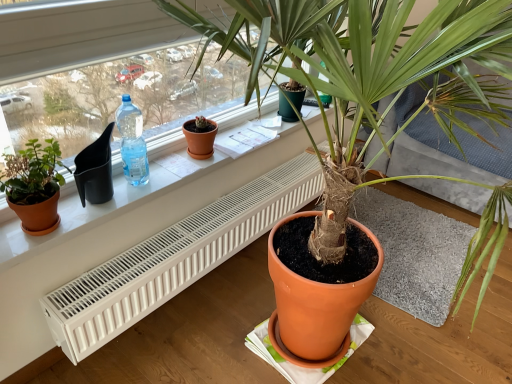
The width and height of the screenshot is (512, 384). What do you see at coordinates (132, 142) in the screenshot? I see `translucent plastic bottle at window left` at bounding box center [132, 142].

At what (x,y) coordinates should I click in order to perform the action: click on matte black pot at upper left. Please return your answer as a coordinate pair (x, y). The image size is (512, 384). Looking at the image, I should click on (120, 96).

This screenshot has height=384, width=512. What do you see at coordinates (174, 259) in the screenshot?
I see `white plastic radiator at lower center` at bounding box center [174, 259].

From the picture: What is the approximate height of matte white radiator at lower center?

It is 3.51 centimeters.

Measure the distance between matte terracotta pot at left, which is the 2th houseplant in right-to-left order, and camera.

A distance of 4.07 feet exists between matte terracotta pot at left, which is the 2th houseplant in right-to-left order, and camera.

The height and width of the screenshot is (384, 512). Describe the element at coordinates (344, 125) in the screenshot. I see `matte orange pot at center, which is the first houseplant in right-to-left order` at that location.

What are the coordinates of `translucent plastic bottle at window left` in the screenshot? It's located at (132, 142).

I want to click on the 1st houseplant positioned above the white plastic radiator at lower center (from the image's perspective), so click(x=34, y=185).

Between matte terracotta pot at left, positioned as the 1th houseplant in left-to-right order, and white plastic radiator at lower center, which one has smaller width?

matte terracotta pot at left, positioned as the 1th houseplant in left-to-right order.

Considering the sizes of objects matte terracotta pot at left, which is the 2th houseplant in right-to-left order, and white plastic radiator at lower center in the image provided, who is shorter, matte terracotta pot at left, which is the 2th houseplant in right-to-left order, or white plastic radiator at lower center?

With less height is white plastic radiator at lower center.

Considering the positions of point (150, 132) and point (11, 158), is point (150, 132) closer or farther from the camera than point (11, 158)?

Point (150, 132) appears to be farther away from the viewer than point (11, 158).

Considering the sizes of objects matte black pot at upper left and matte terracotta pot at left, which is the 2th houseplant in right-to-left order, in the image provided, who is bigger, matte black pot at upper left or matte terracotta pot at left, which is the 2th houseplant in right-to-left order,?

matte black pot at upper left.

Which is correct: matte black pot at upper left is inside matte terracotta pot at left, placed as the 2th houseplant when sorted from front to back, or outside of it?

matte black pot at upper left is not enclosed by matte terracotta pot at left, placed as the 2th houseplant when sorted from front to back.

Considering the relative positions of matte black pot at upper left and terracotta clay pot at center in the image provided, is matte black pot at upper left to the left of terracotta clay pot at center from the viewer's perspective?

Indeed, matte black pot at upper left is positioned on the left side of terracotta clay pot at center.

In the scene shown: From a real-world perspective, is matte black pot at upper left beneath terracotta clay pot at center?

No, from a real-world perspective, matte black pot at upper left is not under terracotta clay pot at center.

Is matte black pot at upper left wider than terracotta clay pot at center?

Correct, the width of matte black pot at upper left exceeds that of terracotta clay pot at center.

Can you confirm if white plastic radiator at lower center is shorter than terracotta clay pot at center?

Incorrect, the height of white plastic radiator at lower center does not fall short of that of terracotta clay pot at center.

From the picture: From a real-world perspective, relative to terracotta clay pot at center, is white plastic radiator at lower center vertically above or below?

Clearly, from a real-world perspective, white plastic radiator at lower center is below terracotta clay pot at center.

Does white plastic radiator at lower center appear on the right side of terracotta clay pot at center?

Yes.

Image resolution: width=512 pixels, height=384 pixels. In order to click on air conditioner in front of the terracotta clay pot at center in this screenshot , I will do `click(174, 259)`.

Locate an element on the screen. This screenshot has height=384, width=512. bottle behind the matte black pot at upper left is located at coordinates (132, 142).

From the image's perspective, is matte black pot at upper left located above translucent plastic bottle at window left?

Yes.

Can you confirm if matte black pot at upper left is thinner than translucent plastic bottle at window left?

In fact, matte black pot at upper left might be wider than translucent plastic bottle at window left.

From the picture: Considering the sizes of objects matte terracotta pot at left, the first houseplant in the back-to-front sequence, and terracotta clay pot at center in the image provided, who is wider, matte terracotta pot at left, the first houseplant in the back-to-front sequence, or terracotta clay pot at center?

matte terracotta pot at left, the first houseplant in the back-to-front sequence, is wider.

Is matte terracotta pot at left, positioned as the 1th houseplant in left-to-right order, looking in the opposite direction of terracotta clay pot at center?

matte terracotta pot at left, positioned as the 1th houseplant in left-to-right order, does not have its back to terracotta clay pot at center.

Is matte terracotta pot at left, placed as the 2th houseplant when sorted from front to back, in contact with terracotta clay pot at center?

matte terracotta pot at left, placed as the 2th houseplant when sorted from front to back, and terracotta clay pot at center are clearly separated.

From the image's perspective, which one is positioned lower, matte terracotta pot at left, which is the 2th houseplant in right-to-left order, or terracotta clay pot at center?

matte terracotta pot at left, which is the 2th houseplant in right-to-left order, is shown below in the image.

Which is more to the right, matte orange pot at center, marked as the 2th houseplant in a back-to-front arrangement, or terracotta clay pot at center?

Positioned to the right is matte orange pot at center, marked as the 2th houseplant in a back-to-front arrangement.

From the image's perspective, is matte orange pot at center, the 2th houseplant when ordered from left to right, located above or below terracotta clay pot at center?

matte orange pot at center, the 2th houseplant when ordered from left to right, is below terracotta clay pot at center.

Which is more distant, [332,137] or [215,132]?

The point [332,137] is farther from the camera.

Is matte orange pot at center, which is the first houseplant in right-to-left order, positioned far away from terracotta clay pot at center?

matte orange pot at center, which is the first houseplant in right-to-left order, is near terracotta clay pot at center, not far away.

This screenshot has width=512, height=384. In order to click on air conditioner lying on the right of matte terracotta pot at left, positioned as the 1th houseplant in left-to-right order in this screenshot , I will do 174,259.

This screenshot has width=512, height=384. I want to click on houseplant that appears behind the matte black pot at upper left, so click(x=34, y=185).

Estimate the real-world distances between objects in this image. Which object is further from matte terracotta pot at left, placed as the 2th houseplant when sorted from front to back, matte black pot at upper left or translucent plastic bottle at window left?

matte black pot at upper left is positioned further to the anchor matte terracotta pot at left, placed as the 2th houseplant when sorted from front to back.

Consider the image. From the image, which object appears to be nearer to white plastic radiator at lower center, terracotta clay pot at center or translucent plastic bottle at window left?

terracotta clay pot at center lies closer to white plastic radiator at lower center than the other object.

Which object lies further to the anchor point matte white radiator at lower center, translucent plastic bottle at window left or matte orange pot at center, which is the first houseplant in right-to-left order?

The object further to matte white radiator at lower center is matte orange pot at center, which is the first houseplant in right-to-left order.

Which object lies further to the anchor point matte orange pot at center, which is the first houseplant in right-to-left order, matte white radiator at lower center or matte black pot at upper left?

matte black pot at upper left is further to matte orange pot at center, which is the first houseplant in right-to-left order.

In the scene shown: Which object lies nearer to the anchor point matte orange pot at center, the 1th houseplant when ordered from front to back, matte terracotta pot at left, positioned as the 1th houseplant in left-to-right order, or translucent plastic bottle at window left?

translucent plastic bottle at window left is closer to matte orange pot at center, the 1th houseplant when ordered from front to back.

In the scene shown: Estimate the real-world distances between objects in this image. Which object is closer to matte terracotta pot at left, placed as the 2th houseplant when sorted from front to back, matte orange pot at center, the 2th houseplant when ordered from left to right, or terracotta clay pot at center?

terracotta clay pot at center lies closer to matte terracotta pot at left, placed as the 2th houseplant when sorted from front to back, than the other object.

Looking at the image, which one is located closer to matte white radiator at lower center, matte black pot at upper left or white plastic radiator at lower center?

white plastic radiator at lower center is closer to matte white radiator at lower center.

Considering their positions, is translucent plastic bottle at window left positioned further to matte terracotta pot at left, placed as the 2th houseplant when sorted from front to back, than terracotta clay pot at center?

terracotta clay pot at center.

Identify the location of bottle between matte black pot at upper left and white plastic radiator at lower center vertically. The width and height of the screenshot is (512, 384). (132, 142).

This screenshot has width=512, height=384. What are the coordinates of `bottle between matte terracotta pot at left, positioned as the 1th houseplant in left-to-right order, and matte white radiator at lower center, in the horizontal direction` in the screenshot? It's located at (132, 142).

Find the location of a particular element. This screenshot has width=512, height=384. bottle between matte terracotta pot at left, which is the 2th houseplant in right-to-left order, and white plastic radiator at lower center, in the horizontal direction is located at coordinates (132, 142).

Locate an element on the screen. window sill positioned between matte black pot at upper left and translucent plastic bottle at window left from near to far is located at coordinates (111, 203).